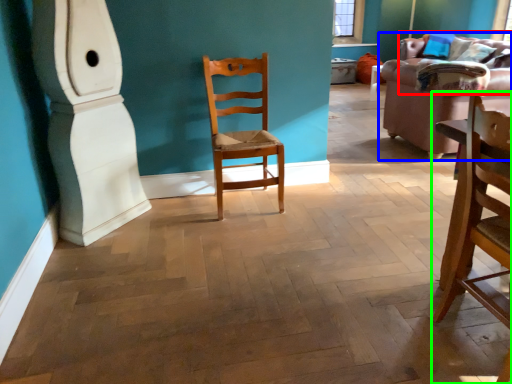
Question: Which object is the farthest from couch (highlighted by a red box)? Choose among these: studio couch (highlighted by a blue box) or chair (highlighted by a green box).

Choices:
 (A) studio couch
 (B) chair

Answer: (B)